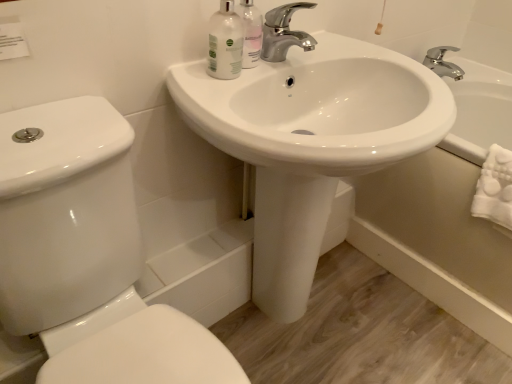
Question: Is white glossy bottle at upper center, acting as the 2th mouthwash starting from the right, turned away from white glossy toilet at lower left?

Choices:
 (A) yes
 (B) no

Answer: (B)

Question: Is white glossy bottle at upper center, acting as the 2th mouthwash starting from the right, at the right side of white glossy toilet at lower left?

Choices:
 (A) yes
 (B) no

Answer: (A)

Question: From the image's perspective, is white glossy bottle at upper center, acting as the 2th mouthwash starting from the right, on top of white glossy toilet at lower left?

Choices:
 (A) no
 (B) yes

Answer: (B)

Question: Does white glossy bottle at upper center, the 1th mouthwash viewed from the left, have a lesser width compared to white glossy toilet at lower left?

Choices:
 (A) no
 (B) yes

Answer: (B)

Question: Is white glossy bottle at upper center, acting as the 2th mouthwash starting from the right, to the left of white glossy toilet at lower left from the viewer's perspective?

Choices:
 (A) no
 (B) yes

Answer: (A)

Question: Would you say chrome metallic faucet at upper center is to the left or to the right of white glossy bottle at upper center, the 1th mouthwash viewed from the left, in the picture?

Choices:
 (A) left
 (B) right

Answer: (B)

Question: Looking at the image, does chrome metallic faucet at upper center seem bigger or smaller compared to white glossy bottle at upper center, the 1th mouthwash viewed from the left?

Choices:
 (A) small
 (B) big

Answer: (B)

Question: In terms of width, does chrome metallic faucet at upper center look wider or thinner when compared to white glossy bottle at upper center, acting as the 2th mouthwash starting from the right?

Choices:
 (A) thin
 (B) wide

Answer: (B)

Question: From a real-world perspective, relative to white glossy bottle at upper center, the 1th mouthwash viewed from the left, is chrome metallic faucet at upper center vertically above or below?

Choices:
 (A) above
 (B) below

Answer: (B)

Question: From the image's perspective, is white glossy bottle at upper center, acting as the 2th mouthwash starting from the right, positioned above or below white glossy bathtub at lower right?

Choices:
 (A) below
 (B) above

Answer: (B)

Question: Considering the positions of white glossy bottle at upper center, acting as the 2th mouthwash starting from the right, and white glossy bathtub at lower right in the image, is white glossy bottle at upper center, acting as the 2th mouthwash starting from the right, taller or shorter than white glossy bathtub at lower right?

Choices:
 (A) short
 (B) tall

Answer: (A)

Question: Would you say white glossy bottle at upper center, the 1th mouthwash viewed from the left, is inside or outside white glossy bathtub at lower right?

Choices:
 (A) inside
 (B) outside

Answer: (B)

Question: Is point (224, 43) closer or farther from the camera than point (481, 226)?

Choices:
 (A) farther
 (B) closer

Answer: (B)

Question: From a real-world perspective, is chrome metallic faucet at upper center positioned above or below white glossy sink at center?

Choices:
 (A) below
 (B) above

Answer: (B)

Question: From the image's perspective, is chrome metallic faucet at upper center above or below white glossy sink at center?

Choices:
 (A) below
 (B) above

Answer: (B)